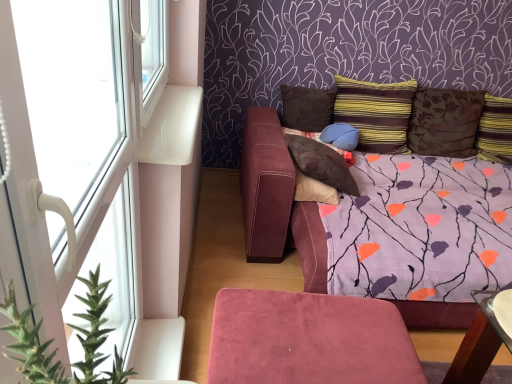
Question: Is white plastic window at upper left, which is the 2th window from bottom to top, inside brown textured pillow at upper right, which appears as the 2th pillow when viewed from the right?

Choices:
 (A) yes
 (B) no

Answer: (B)

Question: From the image's perspective, does brown textured pillow at upper right, which appears as the 2th pillow when viewed from the right, appear higher than white plastic window at upper left, which is the 2th window from bottom to top?

Choices:
 (A) yes
 (B) no

Answer: (B)

Question: Is brown textured pillow at upper right, which appears as the 2th pillow when viewed from the right, placed right next to white plastic window at upper left, placed as the first window when sorted from top to bottom?

Choices:
 (A) yes
 (B) no

Answer: (B)

Question: Is brown textured pillow at upper right, which appears as the 2th pillow when viewed from the right, closer to camera compared to white plastic window at upper left, which is the 2th window from bottom to top?

Choices:
 (A) no
 (B) yes

Answer: (A)

Question: From a real-world perspective, is brown textured pillow at upper right, which appears as the 2th pillow when viewed from the right, on top of white plastic window at upper left, placed as the first window when sorted from top to bottom?

Choices:
 (A) yes
 (B) no

Answer: (B)

Question: Is suede ottoman at lower center situated inside striped fabric pillow at upper right, marked as the 1th pillow in a right-to-left arrangement, or outside?

Choices:
 (A) inside
 (B) outside

Answer: (B)

Question: Considering the positions of suede ottoman at lower center and striped fabric pillow at upper right, marked as the 1th pillow in a right-to-left arrangement, in the image, is suede ottoman at lower center wider or thinner than striped fabric pillow at upper right, marked as the 1th pillow in a right-to-left arrangement,?

Choices:
 (A) wide
 (B) thin

Answer: (A)

Question: In terms of height, does suede ottoman at lower center look taller or shorter compared to striped fabric pillow at upper right, marked as the 1th pillow in a right-to-left arrangement?

Choices:
 (A) short
 (B) tall

Answer: (B)

Question: Does point (286, 375) appear closer or farther from the camera than point (503, 127)?

Choices:
 (A) farther
 (B) closer

Answer: (B)

Question: In terms of width, does brown suede pillow at center, which is the sixth pillow from right to left, look wider or thinner when compared to suede ottoman at lower center?

Choices:
 (A) thin
 (B) wide

Answer: (A)

Question: Is brown suede pillow at center, marked as the 1th pillow in a left-to-right arrangement, inside or outside of suede ottoman at lower center?

Choices:
 (A) inside
 (B) outside

Answer: (B)

Question: Considering the positions of point (352, 160) and point (326, 377), is point (352, 160) closer or farther from the camera than point (326, 377)?

Choices:
 (A) closer
 (B) farther

Answer: (B)

Question: From the image's perspective, relative to suede ottoman at lower center, is brown suede pillow at center, which is the sixth pillow from right to left, above or below?

Choices:
 (A) above
 (B) below

Answer: (A)

Question: From a real-world perspective, is brown suede pillow at center, which is the sixth pillow from right to left, above or below striped fabric pillow at upper right, marked as the 1th pillow in a right-to-left arrangement?

Choices:
 (A) below
 (B) above

Answer: (A)

Question: Considering the positions of brown suede pillow at center, which is the sixth pillow from right to left, and striped fabric pillow at upper right, which ranks as the 6th pillow in left-to-right order, in the image, is brown suede pillow at center, which is the sixth pillow from right to left, taller or shorter than striped fabric pillow at upper right, which ranks as the 6th pillow in left-to-right order,?

Choices:
 (A) tall
 (B) short

Answer: (B)